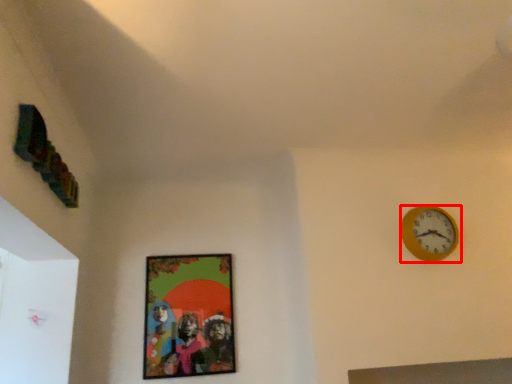
Question: From the image's perspective, where is wall clock (annotated by the red box) located in relation to picture frame in the image?

Choices:
 (A) below
 (B) above

Answer: (B)